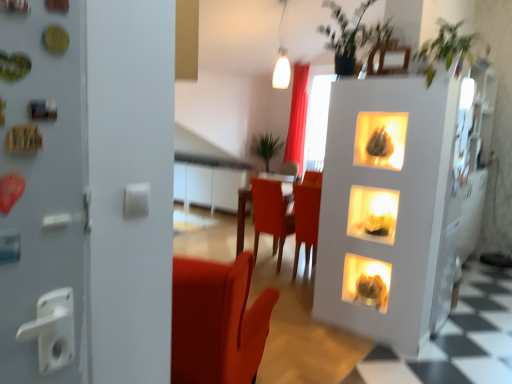
Question: Are green leafy plant at center, acting as the first plant starting from the back, and red velvet curtain at upper center making contact?

Choices:
 (A) no
 (B) yes

Answer: (A)

Question: From the image's perspective, is green leafy plant at center, acting as the first plant starting from the back, over red velvet curtain at upper center?

Choices:
 (A) no
 (B) yes

Answer: (A)

Question: Could red velvet curtain at upper center be considered to be inside green leafy plant at center, marked as the 3th plant in a right-to-left arrangement?

Choices:
 (A) yes
 (B) no

Answer: (B)

Question: Is green leafy plant at center, marked as the 3th plant in a right-to-left arrangement, bigger than red velvet curtain at upper center?

Choices:
 (A) no
 (B) yes

Answer: (B)

Question: Is green leafy plant at center, which is the 3th plant in front-to-back order, not near red velvet curtain at upper center?

Choices:
 (A) yes
 (B) no

Answer: (B)

Question: Is green leafy plant at center, marked as the first plant in a left-to-right arrangement, aimed at red velvet curtain at upper center?

Choices:
 (A) no
 (B) yes

Answer: (A)

Question: Can you confirm if green leafy plant at upper right, which appears as the 3th plant when viewed from the back, is thinner than red velvet curtain at upper center?

Choices:
 (A) no
 (B) yes

Answer: (A)

Question: Is green leafy plant at upper right, the third plant from the left, outside of red velvet curtain at upper center?

Choices:
 (A) no
 (B) yes

Answer: (B)

Question: From a real-world perspective, does green leafy plant at upper right, the third plant from the left, sit lower than red velvet curtain at upper center?

Choices:
 (A) no
 (B) yes

Answer: (A)

Question: Would you consider green leafy plant at upper right, the first plant viewed from the right, to be distant from red velvet curtain at upper center?

Choices:
 (A) no
 (B) yes

Answer: (B)

Question: From a real-world perspective, is green leafy plant at upper right, the third plant from the left, on red velvet curtain at upper center?

Choices:
 (A) no
 (B) yes

Answer: (B)

Question: Is green leafy plant at upper right, which appears as the 3th plant when viewed from the back, shorter than red velvet curtain at upper center?

Choices:
 (A) no
 (B) yes

Answer: (B)

Question: From a real-world perspective, is matte brown fireplace at lower right, which appears as the first fireplace when ordered from the bottom, located higher than green leafy plant at upper center, which ranks as the 2th plant in front-to-back order?

Choices:
 (A) yes
 (B) no

Answer: (B)